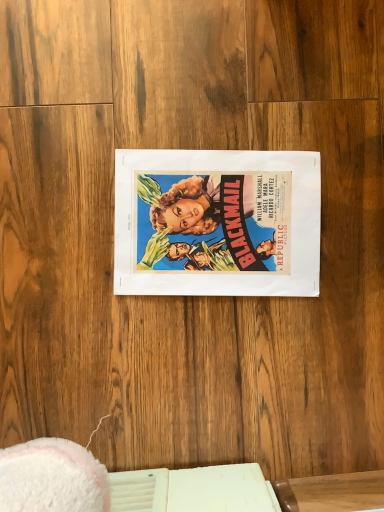
You are a GUI agent. You are given a task and a screenshot of the screen. Output one action in this format:
    pyautogui.click(x=<x>, y=<y>)
    Task: Click on the vacant point above vibrant paper poster at center (from a real-world perspective)
    
    Given the screenshot: What is the action you would take?
    pyautogui.click(x=216, y=216)